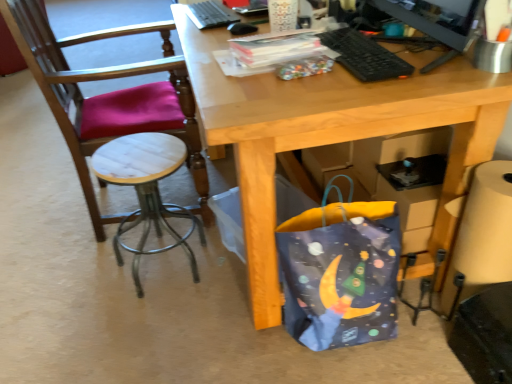
Where is `vacant region to the left of blue fabric bag at lower right`? vacant region to the left of blue fabric bag at lower right is located at coordinates (223, 327).